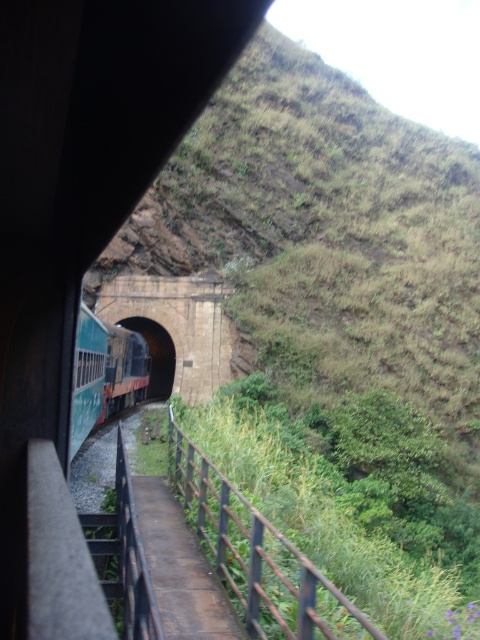
Does brown metal rail at lower center appear over teal glossy passenger train at left?

Actually, brown metal rail at lower center is below teal glossy passenger train at left.

The width and height of the screenshot is (480, 640). What do you see at coordinates (259, 556) in the screenshot?
I see `brown metal rail at lower center` at bounding box center [259, 556].

From the picture: Who is more distant from viewer, (190,468) or (87,392)?

Point (87,392)

In order to click on brown metal rail at lower center in this screenshot , I will do [259, 556].

This screenshot has height=640, width=480. What do you see at coordinates (259, 556) in the screenshot?
I see `brown metal rail at lower center` at bounding box center [259, 556].

Consider the image. Does brown metal rail at lower center have a lesser height compared to brick tunnel at center?

Indeed, brown metal rail at lower center has a lesser height compared to brick tunnel at center.

The width and height of the screenshot is (480, 640). I want to click on brown metal rail at lower center, so click(259, 556).

Does teal glossy passenger train at left come in front of brick tunnel at center?

Yes.

Describe the element at coordinates (105, 372) in the screenshot. The height and width of the screenshot is (640, 480). I see `teal glossy passenger train at left` at that location.

What are the coordinates of `teal glossy passenger train at left` in the screenshot? It's located at (105, 372).